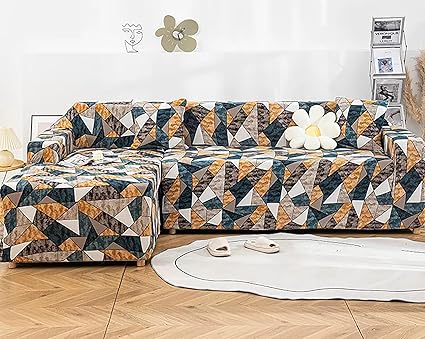
Identify the location of quilted ottoman cover. This screenshot has width=425, height=339. pyautogui.click(x=131, y=231).